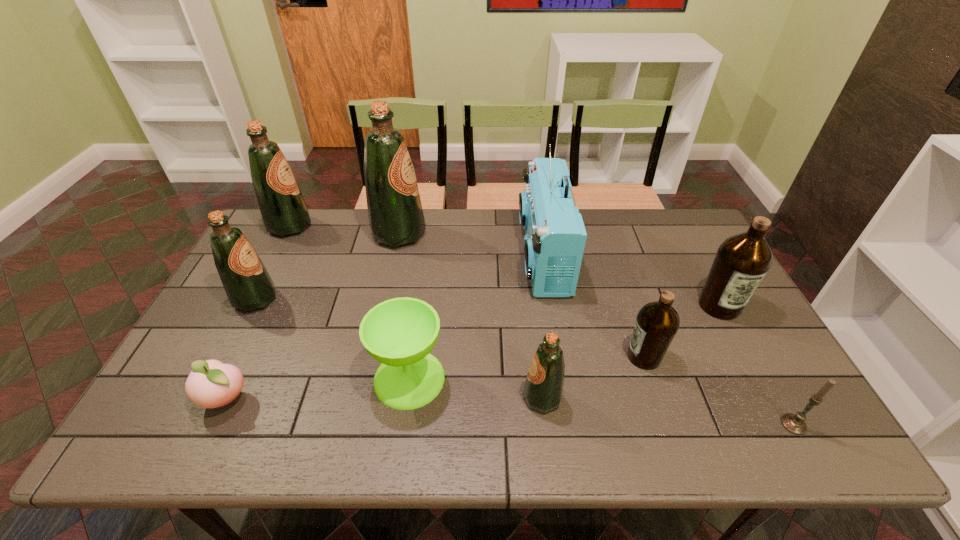
At what (x,y) coordinates should I click in order to perform the action: click on green olive oil that is the closest to the peach. Please return your answer as a coordinate pair (x, y). Looking at the image, I should click on pyautogui.click(x=248, y=285).

Image resolution: width=960 pixels, height=540 pixels. I want to click on vacant point that satisfies the following two spatial constraints: 1. on the label of the candle; 2. on the left side of the left brown olive oil, so click(666, 424).

This screenshot has width=960, height=540. What are the coordinates of `vacant space that satisfies the following two spatial constraints: 1. on the label of the right brown olive oil; 2. on the front-facing side of the nearest olive oil` in the screenshot? It's located at (769, 397).

Identify the location of free location that satisfies the following two spatial constraints: 1. on the back side of the wineglass; 2. on the front-facing side of the second biggest green olive oil. (430, 226).

Locate an element on the screen. free space that satisfies the following two spatial constraints: 1. on the back side of the green wineglass; 2. on the front-facing side of the tallest object is located at coordinates (429, 234).